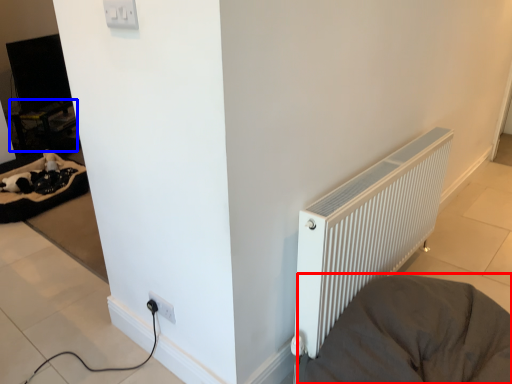
Question: Which object is closer to the camera taking this photo, furniture (highlighted by a red box) or table (highlighted by a blue box)?

Choices:
 (A) furniture
 (B) table

Answer: (A)